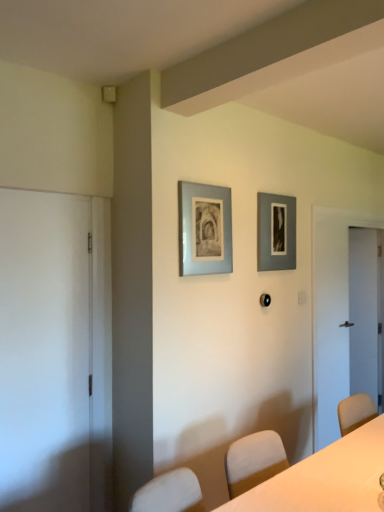
Image resolution: width=384 pixels, height=512 pixels. Find the location of `light blue matte picture frame at upper center, which is the second picture frame from right to left`. light blue matte picture frame at upper center, which is the second picture frame from right to left is located at coordinates (204, 229).

Identify the location of matte gray picture frame at upper center, the 2th picture frame viewed from the left. This screenshot has width=384, height=512. (276, 232).

Identify the location of white glossy table at center. (325, 478).

I want to click on white glossy door at right, the first door when ordered from back to front, so click(x=365, y=313).

Between point (383, 420) and point (260, 212), which one is positioned in front?

The point (383, 420) is closer.

Considering the sizes of objects white glossy table at center and matte gray picture frame at upper center, the first picture frame when ordered from back to front, in the image provided, who is taller, white glossy table at center or matte gray picture frame at upper center, the first picture frame when ordered from back to front,?

matte gray picture frame at upper center, the first picture frame when ordered from back to front.

Is white glossy table at center at the right side of matte gray picture frame at upper center, which appears as the 2th picture frame when viewed from the front?

No.

From the picture: Is white glossy table at center in contact with white matte door at left, which is the second door from right to left?

No, white glossy table at center is not with white matte door at left, which is the second door from right to left.

Which is closer to the camera, (305, 494) or (9, 214)?

Positioned in front is point (305, 494).

Does white glossy table at center appear on the left side of white matte door at left, the second door viewed from the back?

In fact, white glossy table at center is to the right of white matte door at left, the second door viewed from the back.

Is white glossy table at center not inside white matte door at left, marked as the first door in a left-to-right arrangement?

That's correct, white glossy table at center is outside of white matte door at left, marked as the first door in a left-to-right arrangement.

Is matte gray picture frame at upper center, which appears as the 2th picture frame when viewed from the front, at the right side of white glossy table at center?

Indeed, matte gray picture frame at upper center, which appears as the 2th picture frame when viewed from the front, is positioned on the right side of white glossy table at center.

From a real-world perspective, is matte gray picture frame at upper center, placed as the first picture frame when sorted from right to left, located beneath white glossy table at center?

Incorrect, from a real-world perspective, matte gray picture frame at upper center, placed as the first picture frame when sorted from right to left, is higher than white glossy table at center.

There is a white glossy table at center. Where is `the 2nd picture frame above it (from the image's perspective)`? the 2nd picture frame above it (from the image's perspective) is located at coordinates (276, 232).

Could you measure the distance between matte gray picture frame at upper center, the first picture frame when ordered from back to front, and white glossy table at center?

They are 1.24 meters apart.

Is white matte door at left, which is the first door from front to back, behind light blue matte picture frame at upper center, placed as the first picture frame when sorted from left to right?

No, it is not.

From a real-world perspective, which object rests below the other?

In real-world perspective, white matte door at left, which is the first door from front to back, is lower.

In terms of width, does white matte door at left, the second door viewed from the back, look wider or thinner when compared to light blue matte picture frame at upper center, placed as the first picture frame when sorted from left to right?

Clearly, white matte door at left, the second door viewed from the back, has more width compared to light blue matte picture frame at upper center, placed as the first picture frame when sorted from left to right.

This screenshot has height=512, width=384. I want to click on the 1st picture frame positioned above the white matte door at left, which is the first door from front to back (from a real-world perspective), so click(204, 229).

Relative to light blue matte picture frame at upper center, which is the second picture frame from right to left, is matte gray picture frame at upper center, the first picture frame when ordered from back to front, in front or behind?

Clearly, matte gray picture frame at upper center, the first picture frame when ordered from back to front, is behind light blue matte picture frame at upper center, which is the second picture frame from right to left.

Is point (268, 236) closer to viewer compared to point (186, 254)?

No, (268, 236) is further to viewer.

At what (x,y) coordinates should I click in order to perform the action: click on picture frame behind the light blue matte picture frame at upper center, which is the second picture frame from right to left. Please return your answer as a coordinate pair (x, y). Looking at the image, I should click on (276, 232).

From a real-world perspective, between matte gray picture frame at upper center, placed as the first picture frame when sorted from right to left, and light blue matte picture frame at upper center, the 1th picture frame from the front, who is vertically lower?

In real-world perspective, light blue matte picture frame at upper center, the 1th picture frame from the front, is lower.

From the picture: Is white matte door at left, which is the second door from right to left, located outside white glossy table at center?

white matte door at left, which is the second door from right to left, lies outside white glossy table at center's area.

Find the location of `the 1st door behind the white glossy table at center`. the 1st door behind the white glossy table at center is located at coordinates [x=44, y=351].

What's the angular difference between white matte door at left, which is the second door from right to left, and white glossy table at center's facing directions?

white matte door at left, which is the second door from right to left, and white glossy table at center are facing 4.84 degrees away from each other.

Is white matte door at left, which is the first door from front to back, aimed at white glossy table at center?

No, white matte door at left, which is the first door from front to back, does not turn towards white glossy table at center.

Is white glossy door at right, the 2th door from the left, taller or shorter than white glossy table at center?

white glossy door at right, the 2th door from the left, is taller than white glossy table at center.

Which point is more forward, (381, 362) or (379, 450)?

Point (379, 450)

Is white glossy door at right, which ranks as the 1th door in right-to-left order, wider than white glossy table at center?

In fact, white glossy door at right, which ranks as the 1th door in right-to-left order, might be narrower than white glossy table at center.

Based on the photo, which is more to the left, white glossy door at right, which ranks as the 1th door in right-to-left order, or white glossy table at center?

white glossy table at center.

Find the location of a particular element. Image resolution: width=384 pixels, height=512 pixels. the 2nd picture frame positioned above the white glossy table at center (from the image's perspective) is located at coordinates (276, 232).

This screenshot has height=512, width=384. I want to click on the 1st door behind the white glossy table at center, counting from the anchor's position, so click(x=44, y=351).

Considering their positions, is white glossy table at center positioned further to light blue matte picture frame at upper center, placed as the first picture frame when sorted from left to right, than matte gray picture frame at upper center, the first picture frame when ordered from back to front?

white glossy table at center.

When comparing their distances from matte gray picture frame at upper center, the 2th picture frame viewed from the left, does light blue matte picture frame at upper center, marked as the 2th picture frame in a back-to-front arrangement, or white matte door at left, marked as the first door in a left-to-right arrangement, seem closer?

Among the two, light blue matte picture frame at upper center, marked as the 2th picture frame in a back-to-front arrangement, is located nearer to matte gray picture frame at upper center, the 2th picture frame viewed from the left.

Estimate the real-world distances between objects in this image. Which object is further from white matte door at left, which is the second door from right to left, white glossy table at center or matte gray picture frame at upper center, the 2th picture frame viewed from the left?

The object further to white matte door at left, which is the second door from right to left, is matte gray picture frame at upper center, the 2th picture frame viewed from the left.

Considering their positions, is white matte door at left, marked as the first door in a left-to-right arrangement, positioned closer to white glossy door at right, which ranks as the 1th door in right-to-left order, than white glossy table at center?

white glossy table at center is closer to white glossy door at right, which ranks as the 1th door in right-to-left order.

From the image, which object appears to be farther from matte gray picture frame at upper center, placed as the first picture frame when sorted from right to left, white matte door at left, the second door viewed from the back, or white glossy door at right, which ranks as the 1th door in right-to-left order?

white glossy door at right, which ranks as the 1th door in right-to-left order, is positioned further to the anchor matte gray picture frame at upper center, placed as the first picture frame when sorted from right to left.

Based on their spatial positions, is white glossy table at center or matte gray picture frame at upper center, which appears as the 2th picture frame when viewed from the front, further from white glossy door at right, which ranks as the 1th door in right-to-left order?

white glossy table at center lies further to white glossy door at right, which ranks as the 1th door in right-to-left order, than the other object.

Considering their positions, is matte gray picture frame at upper center, placed as the first picture frame when sorted from right to left, positioned closer to white matte door at left, which is the second door from right to left, than light blue matte picture frame at upper center, placed as the first picture frame when sorted from left to right?

light blue matte picture frame at upper center, placed as the first picture frame when sorted from left to right, lies closer to white matte door at left, which is the second door from right to left, than the other object.

Which object lies nearer to the anchor point white glossy door at right, which ranks as the 1th door in right-to-left order, matte gray picture frame at upper center, which appears as the 2th picture frame when viewed from the front, or light blue matte picture frame at upper center, which is the second picture frame from right to left?

matte gray picture frame at upper center, which appears as the 2th picture frame when viewed from the front, is positioned closer to the anchor white glossy door at right, which ranks as the 1th door in right-to-left order.

I want to click on door between white glossy table at center and white glossy door at right, the 2th door from the left, in the front-back direction, so click(44, 351).

I want to click on picture frame between matte gray picture frame at upper center, the first picture frame when ordered from back to front, and white glossy table at center vertically, so point(204,229).

The height and width of the screenshot is (512, 384). I want to click on picture frame between light blue matte picture frame at upper center, marked as the 2th picture frame in a back-to-front arrangement, and white glossy door at right, the second door positioned from the front, from front to back, so click(276, 232).

Locate an element on the screen. table between white matte door at left, the second door viewed from the back, and matte gray picture frame at upper center, the 2th picture frame viewed from the left is located at coordinates (325, 478).